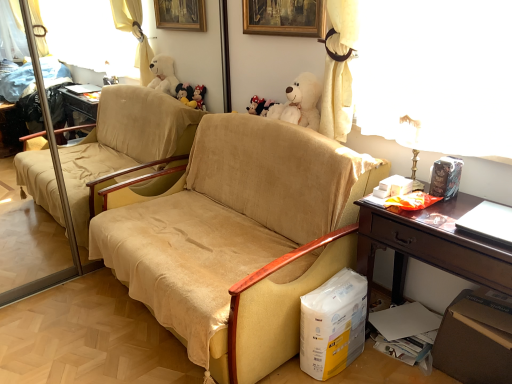
Question: Is brown wooden desk at right to the left or to the right of beige fabric chair at center in the image?

Choices:
 (A) left
 (B) right

Answer: (B)

Question: Which is correct: brown wooden desk at right is inside beige fabric chair at center, or outside of it?

Choices:
 (A) outside
 (B) inside

Answer: (A)

Question: Which object is positioned closest to the brown cardboard box at lower right?

Choices:
 (A) beige fabric chair at center
 (B) brown wooden desk at right
 (C) white plush bear at upper center

Answer: (B)

Question: Which is farther from the beige fabric chair at center?

Choices:
 (A) brown cardboard box at lower right
 (B) white plush bear at upper center
 (C) brown wooden desk at right

Answer: (A)